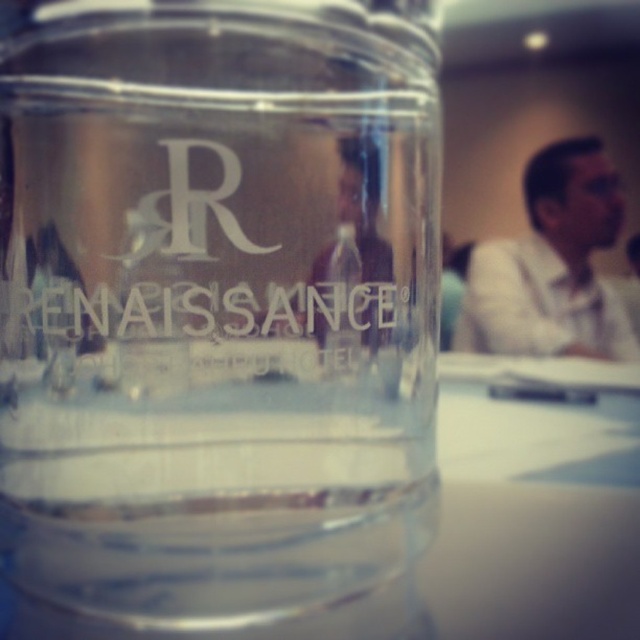
Does transparent glass at center have a lesser width compared to whitematerial/texturerenaissance at center?

In fact, transparent glass at center might be wider than whitematerial/texturerenaissance at center.

Between transparent glass at center and whitematerial/texturerenaissance at center, which one appears on the left side from the viewer's perspective?

Positioned to the left is whitematerial/texturerenaissance at center.

Between point (616, 627) and point (28, 291), which one is positioned in front?

Point (616, 627)

Where is `transparent glass at center`? The image size is (640, 640). transparent glass at center is located at coordinates (518, 509).

Does transparent glass jar at center appear over whitematerial/texturerenaissance at center?

Incorrect, transparent glass jar at center is not positioned above whitematerial/texturerenaissance at center.

Find the location of a particular element. The height and width of the screenshot is (640, 640). transparent glass jar at center is located at coordinates (218, 312).

Is point (33, 294) more distant than point (99, 298)?

Yes, point (33, 294) is behind point (99, 298).

Find the location of a particular element. transparent glass jar at center is located at coordinates (218, 312).

In order to click on transparent glass jar at center in this screenshot , I will do `click(218, 312)`.

Does transparent glass jar at center have a lesser width compared to transparent glass at center?

Yes.

This screenshot has width=640, height=640. Describe the element at coordinates (218, 312) in the screenshot. I see `transparent glass jar at center` at that location.

The height and width of the screenshot is (640, 640). I want to click on transparent glass jar at center, so click(218, 312).